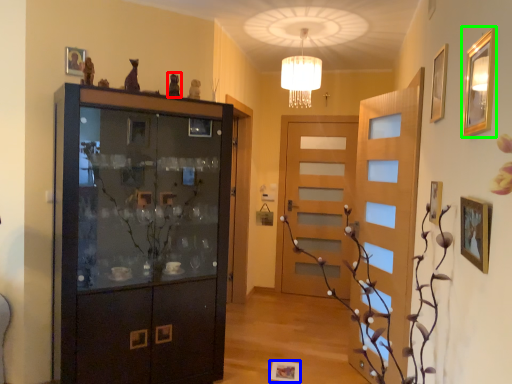
Question: Which is farther away from art (highlighted by a red box)? picture frame (highlighted by a blue box) or picture frame (highlighted by a green box)?

Choices:
 (A) picture frame
 (B) picture frame

Answer: (A)